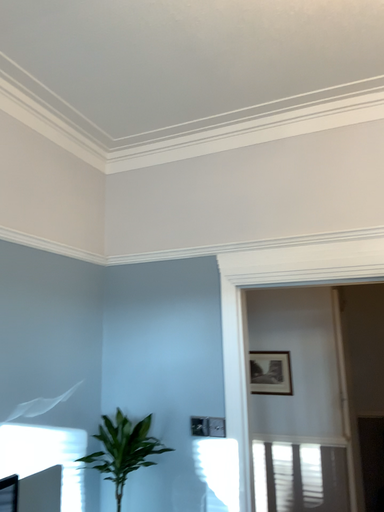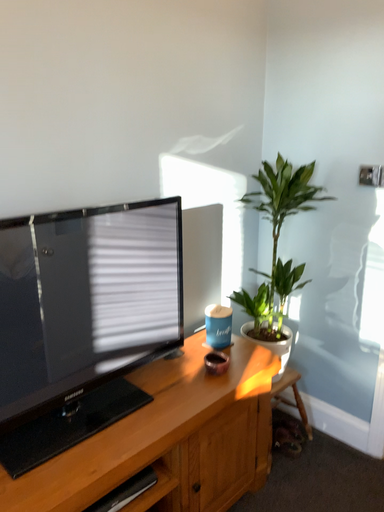
Question: Which way did the camera rotate in the video?

Choices:
 (A) rotated left
 (B) rotated right

Answer: (A)